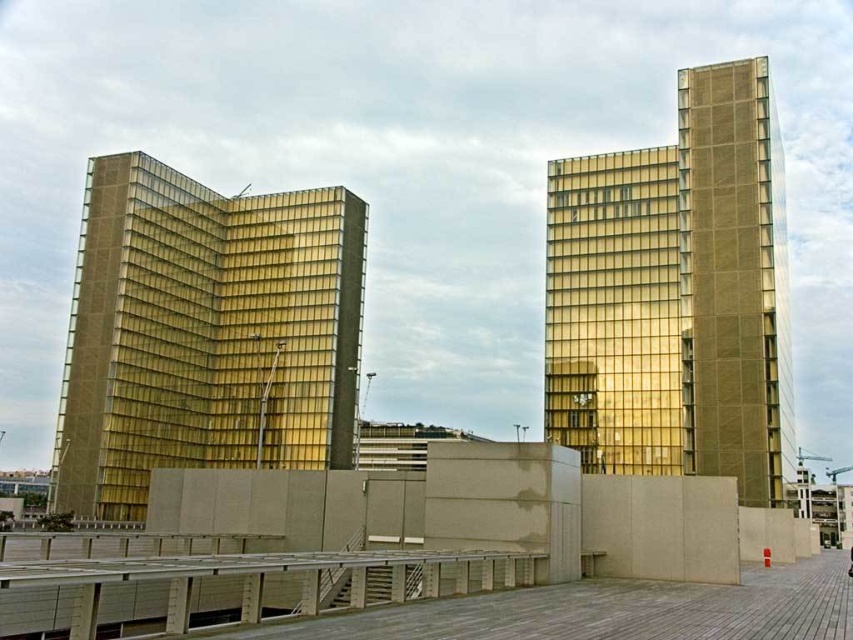
You are a drone operator who needs to fly a drone between the two buildings. The drone has a maximum flight distance of 70 meters. Based on the scene, can the drone safely fly between the gold glass building at left and the other building?

The two buildings are 72.44 meters apart, which exceeds the drone maximum flight distance of 70 meters. Therefore, the drone cannot safely fly between the gold glass building at left and the other building.

In the scene shown: You are standing at the base of the two modern high rise buildings. You notice two points marked on the buildings. The first point is located at coordinates point (x=221, y=308) and the second at point (x=727, y=326). If you were to draw a straight line between them, would the line pass through any part of the building on the right?

The line between point (x=221, y=308) and point (x=727, y=326) would pass through the building on the right because point (x=221, y=308) is behind point (x=727, y=326).

You are standing at the point marked by the coordinate point at (206, 333) in the image. Which building are you facing? The gold glass building at left or the right building?

The point at (206, 333) indicates the gold glass building at left, so you are facing the gold glass building at left.